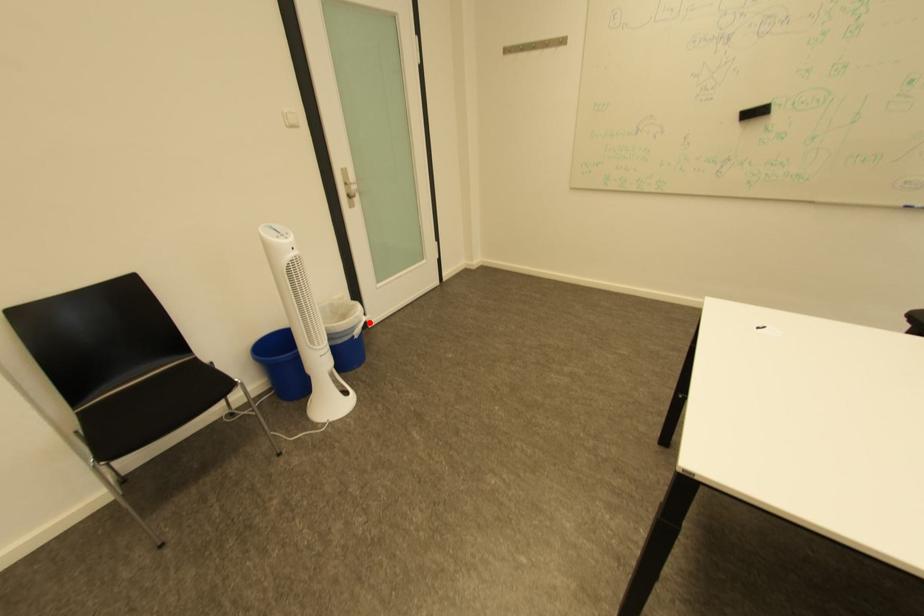
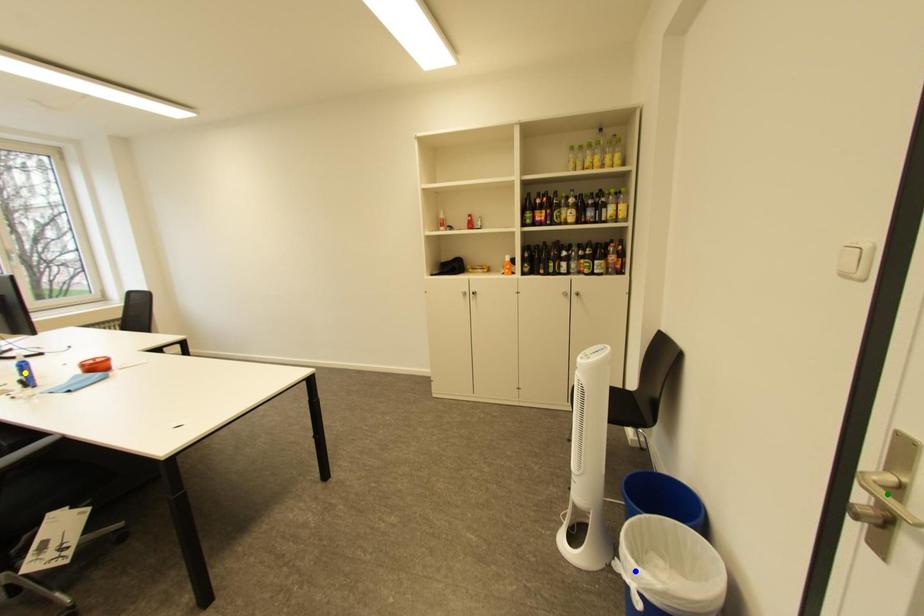
Question: I am providing you with two images of the same scene from different viewpoints. A red point is marked on the first image. You are given multiple points on the second image. Which point in image 2 is actually the same real-world point as the red point in image 1?

Choices:
 (A) green point
 (B) yellow point
 (C) blue point

Answer: (C)